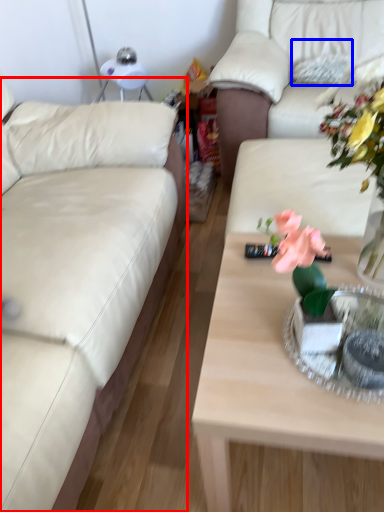
Question: Which object is further to the camera taking this photo, studio couch (highlighted by a red box) or pillow (highlighted by a blue box)?

Choices:
 (A) studio couch
 (B) pillow

Answer: (B)